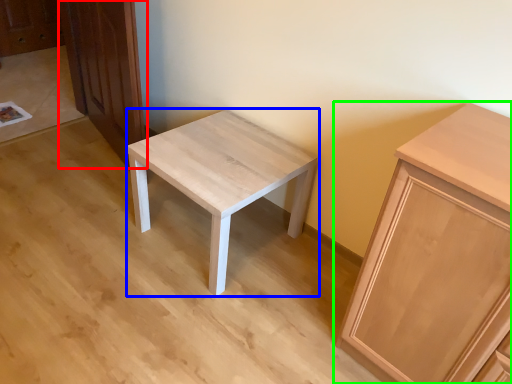
Question: Which object is positioned closest to dresser (highlighted by a red box)? Select from stool (highlighted by a blue box) and cabinetry (highlighted by a green box).

Choices:
 (A) stool
 (B) cabinetry

Answer: (A)